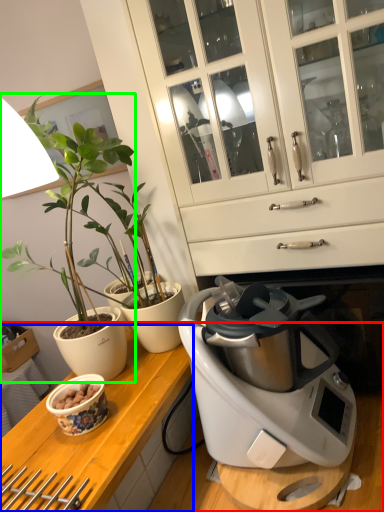
Question: Which object is positioned farthest from countertop (highlighted by a red box)? Select from counter top (highlighted by a blue box) and houseplant (highlighted by a green box).

Choices:
 (A) counter top
 (B) houseplant

Answer: (B)